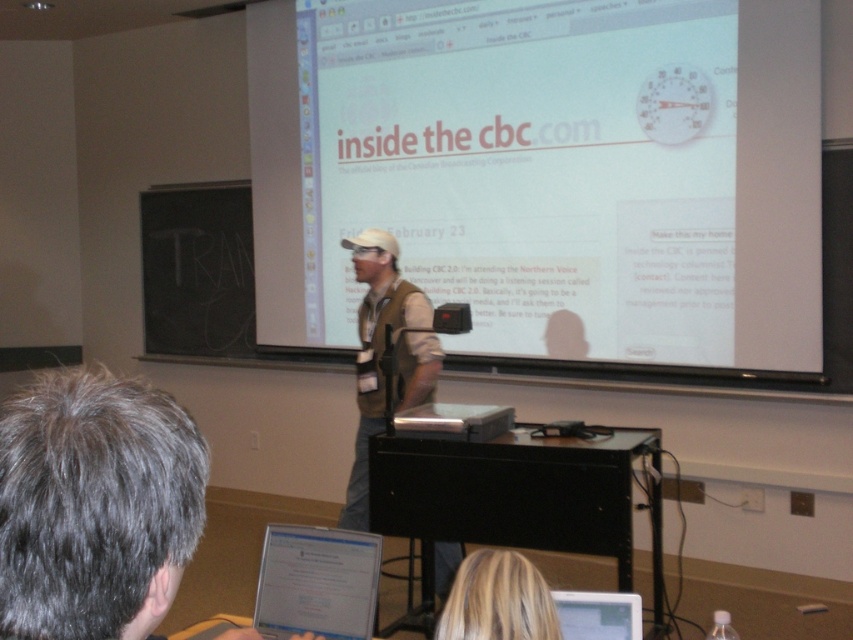
Question: Which object is closer to the camera taking this photo?

Choices:
 (A) blonde hair at lower center
 (B) silver metallic laptop at lower center

Answer: (A)

Question: Considering the relative positions of khaki vest at center and silver metallic laptop at lower center in the image provided, where is khaki vest at center located with respect to silver metallic laptop at lower center?

Choices:
 (A) below
 (B) above

Answer: (B)

Question: Where is white glossy tablet at lower center located in relation to blonde hair at lower center in the image?

Choices:
 (A) left
 (B) right

Answer: (A)

Question: Which of the following is the farthest from the observer?

Choices:
 (A) khaki vest at center
 (B) white matte projection screen at center

Answer: (B)

Question: Can you confirm if white matte projection screen at center is positioned above silver metallic laptop at lower center?

Choices:
 (A) no
 (B) yes

Answer: (B)

Question: Among these points, which one is farthest from the camera?

Choices:
 (A) (372, 268)
 (B) (537, 596)
 (C) (270, 524)
 (D) (611, 625)

Answer: (C)